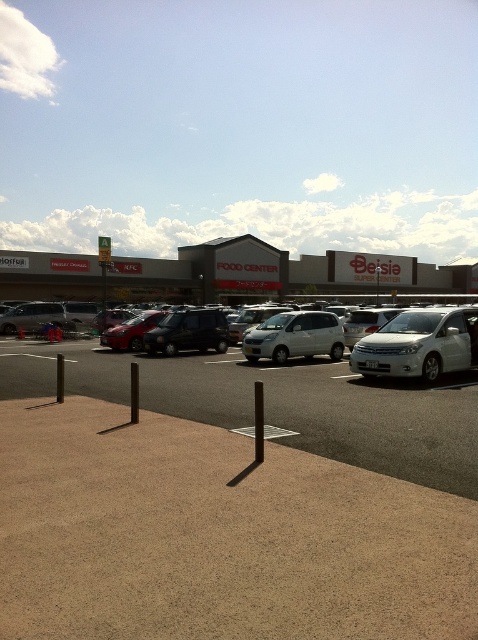
Question: Is gray concrete building at center below silver metallic sedan at center?

Choices:
 (A) no
 (B) yes

Answer: (A)

Question: Can you confirm if satin silver minivan at center is positioned above shiny black suv at center?

Choices:
 (A) no
 (B) yes

Answer: (A)

Question: Which object is the closest to the gray concrete building at center?

Choices:
 (A) shiny black suv at center
 (B) metallic red car at center
 (C) satin silver minivan at center
 (D) silver metallic sedan at center

Answer: (D)

Question: Which point is farther to the camera?

Choices:
 (A) (21, 280)
 (B) (128, 340)
 (C) (162, 352)
 (D) (227, 374)

Answer: (A)

Question: Which object is the farthest from the shiny black suv at center?

Choices:
 (A) white metallic car at right
 (B) satin silver minivan at center
 (C) gray concrete building at center
 (D) metallic red car at center

Answer: (C)

Question: From the image, what is the correct spatial relationship of gray concrete building at center in relation to satin silver minivan at center?

Choices:
 (A) above
 (B) below

Answer: (A)